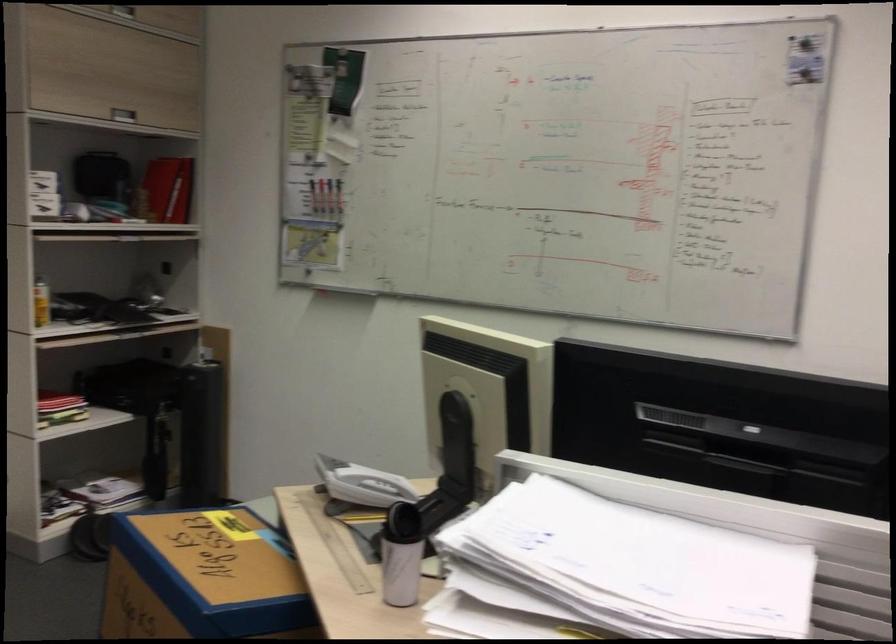
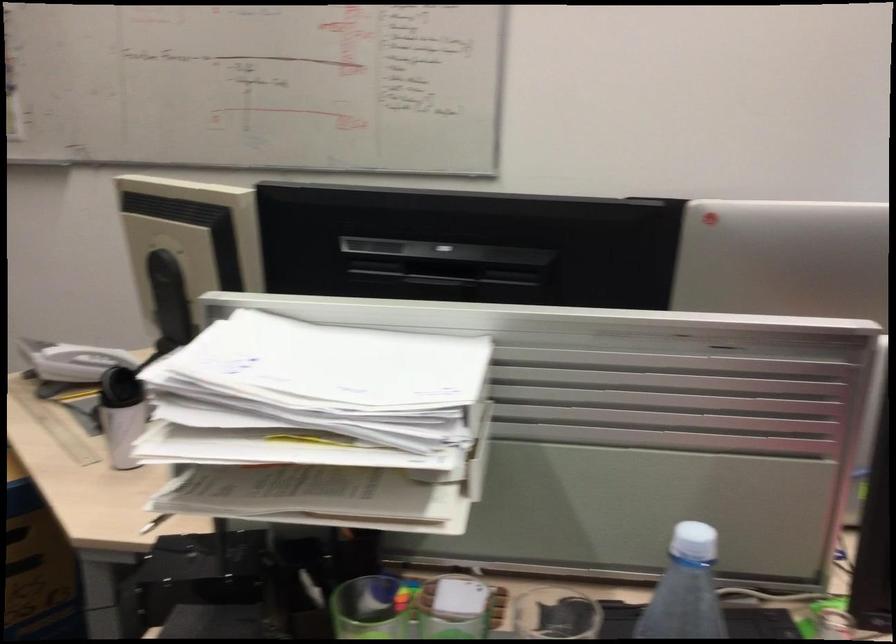
The point at (354, 480) is marked in the first image. Where is the corresponding point in the second image?

(72, 361)